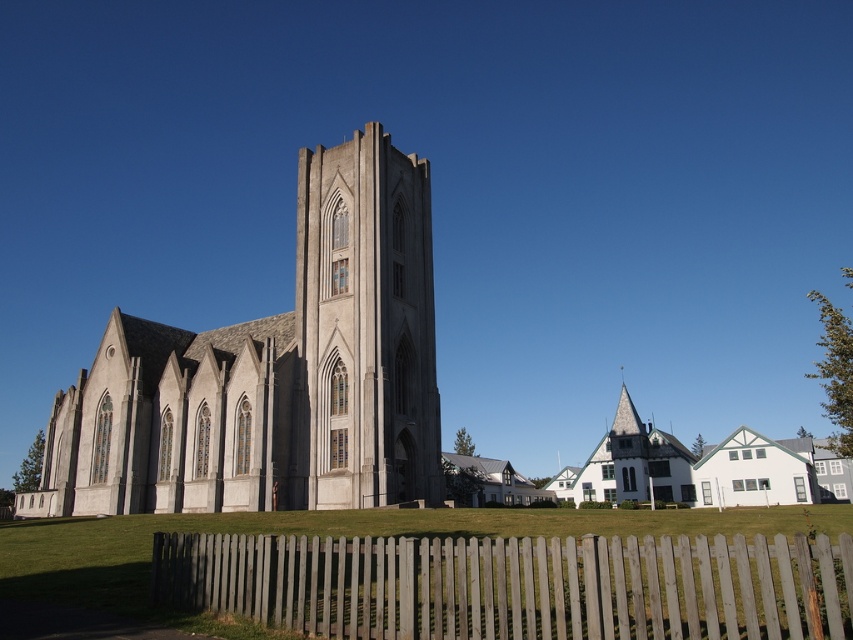
Question: Does gray stone church at center have a smaller size compared to gray wooden fence at lower center?

Choices:
 (A) yes
 (B) no

Answer: (B)

Question: Considering the relative positions of gray stone church at center and gray wooden fence at lower center in the image provided, where is gray stone church at center located with respect to gray wooden fence at lower center?

Choices:
 (A) right
 (B) left

Answer: (B)

Question: Which object is farther from the camera taking this photo?

Choices:
 (A) white painted wood church at center
 (B) gray stone church at center
 (C) gray wooden fence at lower center
 (D) smooth concrete tower at center

Answer: (A)

Question: Which is farther from the gray wooden fence at lower center?

Choices:
 (A) smooth concrete tower at center
 (B) gray stone church at center

Answer: (B)

Question: Which point is closer to the camera?

Choices:
 (A) (318, 486)
 (B) (813, 595)
 (C) (642, 442)
 (D) (79, 436)

Answer: (B)

Question: Is gray stone church at center thinner than gray wooden fence at lower center?

Choices:
 (A) no
 (B) yes

Answer: (A)